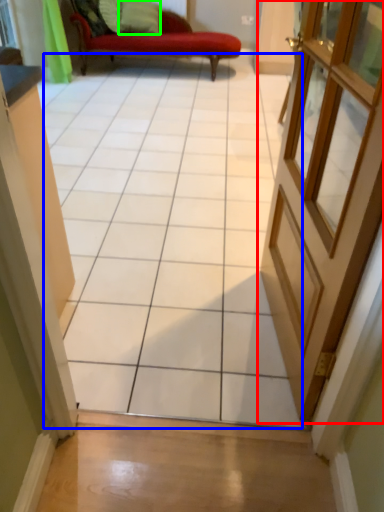
Question: Estimate the real-world distances between objects in this image. Which object is closer to door (highlighted by a red box), ceramic tile (highlighted by a blue box) or pillow (highlighted by a green box)?

Choices:
 (A) ceramic tile
 (B) pillow

Answer: (A)